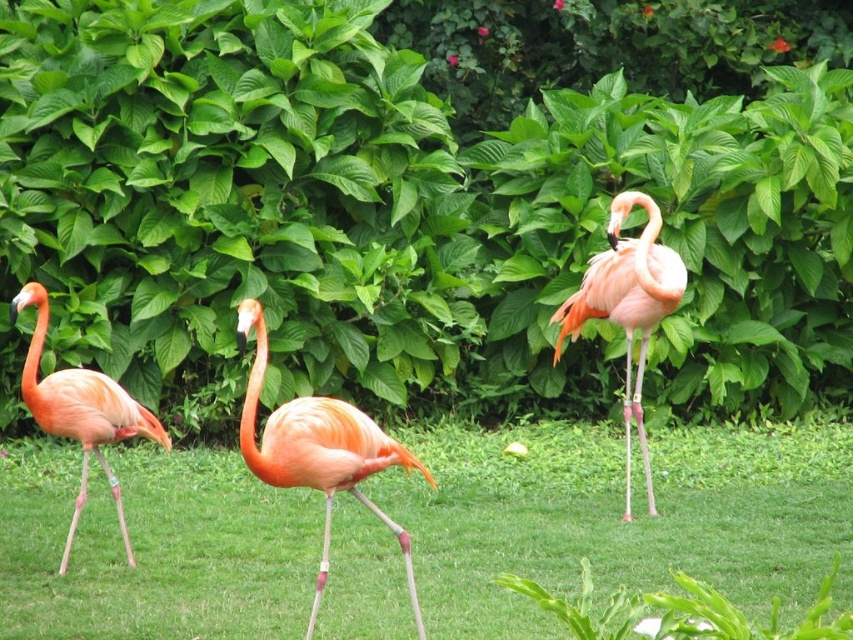
Is point (556, 348) farther from viewer compared to point (120, 524)?

Yes, point (556, 348) is farther from viewer.

Can you confirm if pink matte flamingo at center is positioned to the left of pink matte flamingo at left?

No, pink matte flamingo at center is not to the left of pink matte flamingo at left.

Who is more forward, (602, 305) or (96, 432)?

Point (96, 432) is in front.

Find the location of a particular element. This screenshot has width=853, height=640. pink matte flamingo at center is located at coordinates (627, 305).

The width and height of the screenshot is (853, 640). What do you see at coordinates (618, 518) in the screenshot?
I see `green grass at center` at bounding box center [618, 518].

Which of these two, green grass at center or pink matte flamingo at center, stands taller?

pink matte flamingo at center

Locate an element on the screen. This screenshot has height=640, width=853. green grass at center is located at coordinates (618, 518).

Does point (16, 465) come closer to viewer compared to point (102, 394)?

That is False.

Can you confirm if green grass at center is bigger than pink matte flamingo at left?

Actually, green grass at center might be smaller than pink matte flamingo at left.

Between point (379, 552) and point (103, 416), which one is positioned in front?

Point (103, 416) is in front.

At what (x,y) coordinates should I click in order to perform the action: click on green grass at center. Please return your answer as a coordinate pair (x, y). Looking at the image, I should click on (618, 518).